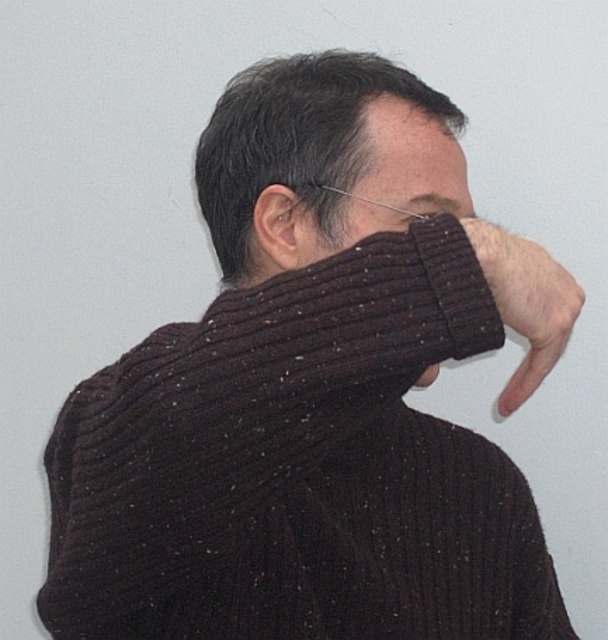
You are a photographer adjusting the focus of your camera. You want to ensure both the matte brown hair at upper center and the matte black nose at center are in focus. Given their sizes, which object should you adjust the focus towards first to ensure proper sharpness?

The matte brown hair at upper center is larger in size than the matte black nose at center, so you should adjust the focus towards the matte brown hair at upper center first to ensure proper sharpness.

You are a photographer adjusting the focus on a camera. The subject in the image has matte brown hair at upper center and matte black nose at center. Which feature should you focus on if you want to prioritize the nose but ensure the hair is still in focus? The minimum focus distance between them is 2.08 inches.

Since the matte brown hair at upper center and matte black nose at center are 2.08 inches apart, you should focus on the matte black nose at center and use a narrow aperture to keep both features in focus within the depth of field.

You are a photographer trying to capture the face of the person in the image. The subject is wearing a dark ribbed sweater at center and has a matte black face at center. Which object is blocking your view of the face?

The dark ribbed sweater at center is blocking the view of the matte black face at center because the matte black face at center is behind the dark ribbed sweater at center.